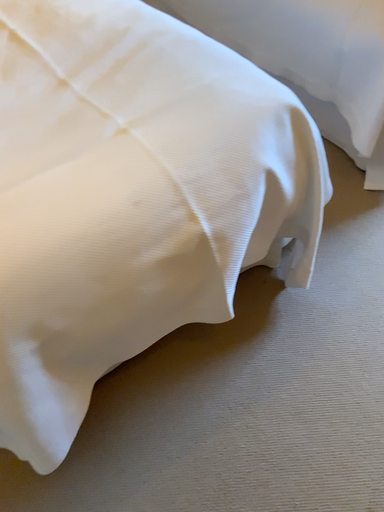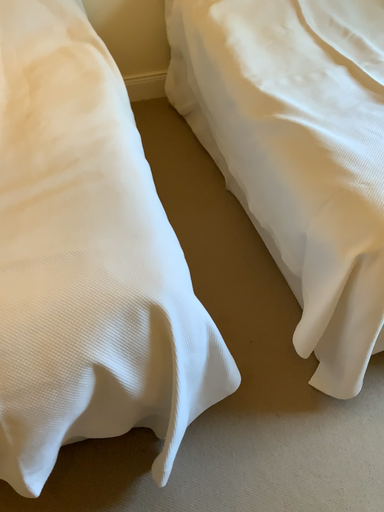
Question: How did the camera likely rotate when shooting the video?

Choices:
 (A) rotated downward
 (B) rotated upward

Answer: (B)